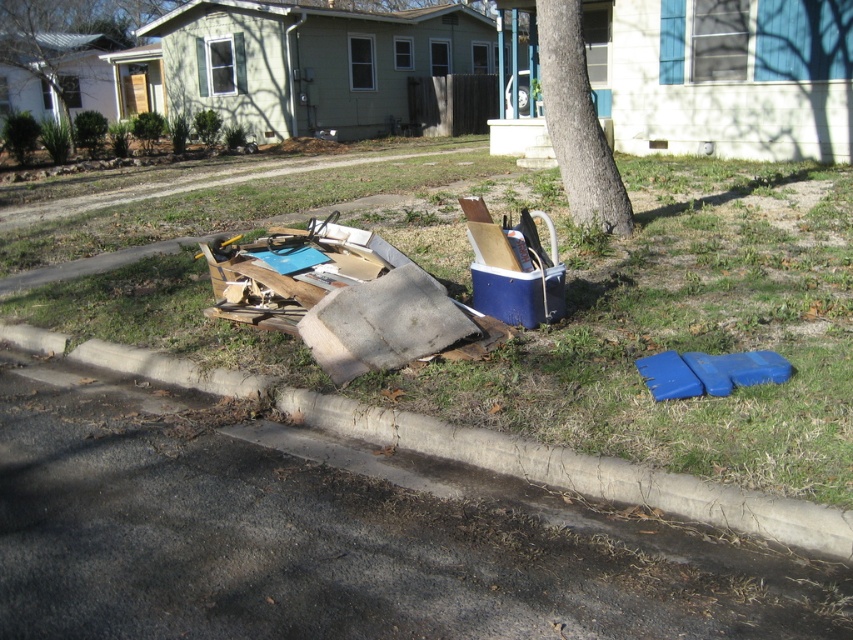
Measure the distance between point (556, 416) and camera.

Point (556, 416) and camera are 14.88 feet apart.

Can you confirm if green grass at center is thinner than concrete at lower left?

Incorrect, green grass at center's width is not less than concrete at lower left's.

The width and height of the screenshot is (853, 640). Identify the location of green grass at center. (680, 328).

The image size is (853, 640). What do you see at coordinates (503, 452) in the screenshot? I see `concrete at lower left` at bounding box center [503, 452].

Can you confirm if concrete at lower left is positioned to the left of brown rough bark tree at upper center?

Correct, you'll find concrete at lower left to the left of brown rough bark tree at upper center.

Which is in front, point (660, 488) or point (579, 10)?

Point (660, 488) is in front.

You are a GUI agent. You are given a task and a screenshot of the screen. Output one action in this format:
    pyautogui.click(x=<x>, y=<y>)
    Task: Click on the concrete at lower left
    The height and width of the screenshot is (640, 853).
    Given the screenshot: What is the action you would take?
    pyautogui.click(x=503, y=452)

Can you confirm if green grass at center is shorter than brown rough bark tree at upper center?

No, green grass at center is not shorter than brown rough bark tree at upper center.

Does green grass at center have a smaller size compared to brown rough bark tree at upper center?

Actually, green grass at center might be larger than brown rough bark tree at upper center.

Which is in front, point (160, 340) or point (567, 157)?

Point (160, 340) is in front.

Locate an element on the screen. Image resolution: width=853 pixels, height=640 pixels. green grass at center is located at coordinates (680, 328).